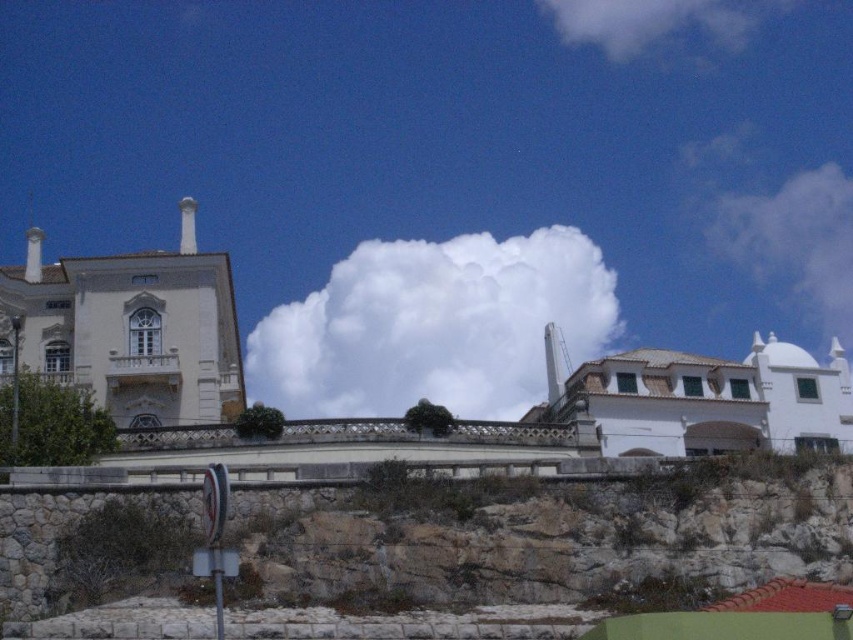
Question: Does rocky cliff at lower center appear over white fluffy cloud at upper right?

Choices:
 (A) yes
 (B) no

Answer: (B)

Question: Which of these objects is positioned closest to the white fluffy cloud at upper right?

Choices:
 (A) rocky cliff at lower center
 (B) white fluffy cloud at center

Answer: (B)

Question: Is rocky cliff at lower center wider than white fluffy cloud at center?

Choices:
 (A) yes
 (B) no

Answer: (B)

Question: Where is rocky cliff at lower center located in relation to white fluffy cloud at upper right in the image?

Choices:
 (A) right
 (B) left

Answer: (B)

Question: Among these points, which one is nearest to the camera?

Choices:
 (A) (804, 240)
 (B) (722, 28)
 (C) (370, 264)

Answer: (C)

Question: Which object is farther from the camera taking this photo?

Choices:
 (A) rocky cliff at lower center
 (B) white fluffy cloud at upper center

Answer: (B)